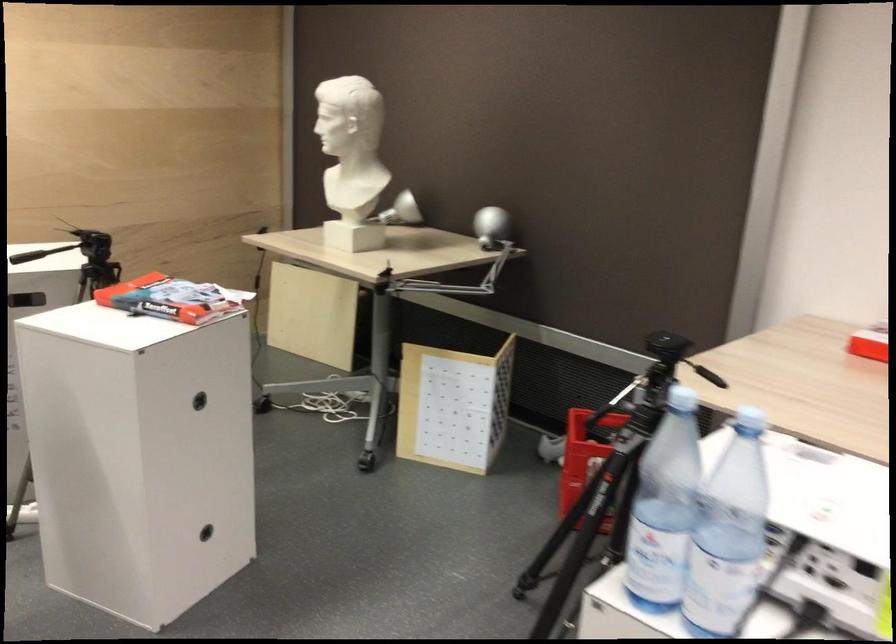
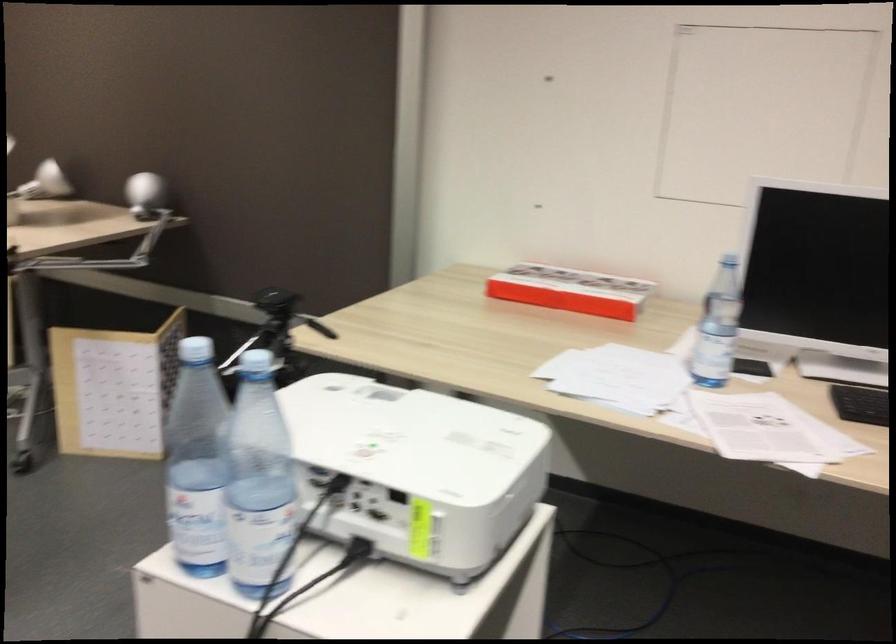
In the second image, find the point that corresponds to point (494, 216) in the first image.

(143, 194)